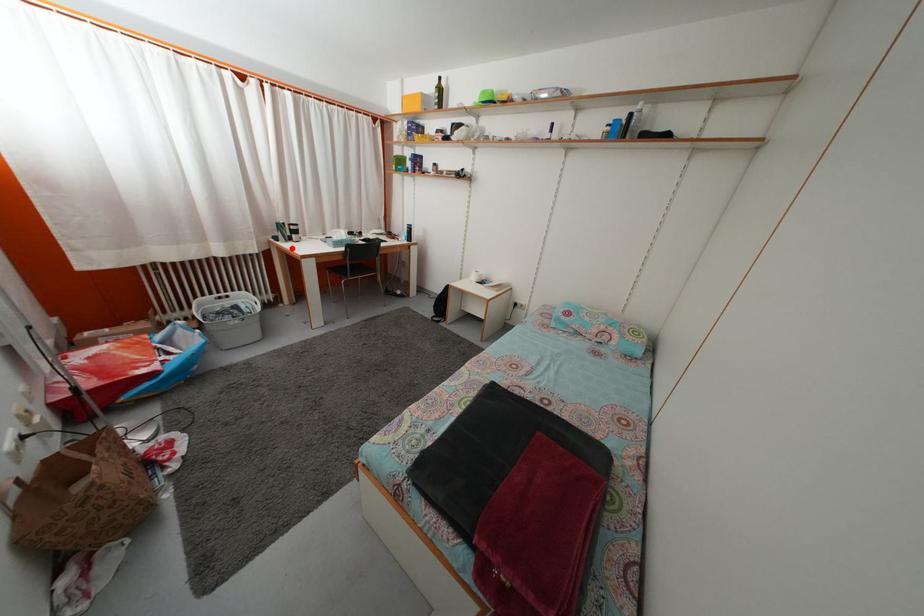
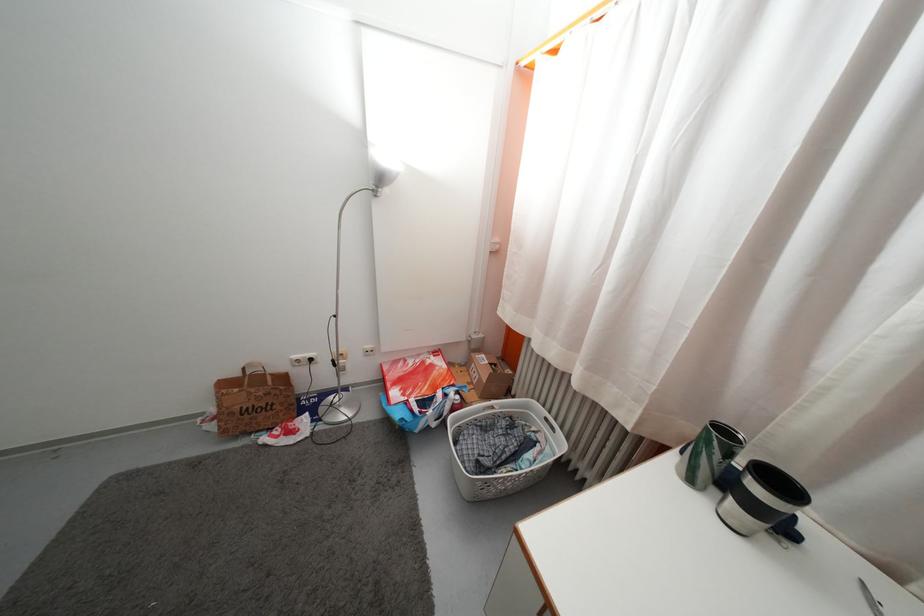
In the second image, find the point that corresponds to the highlighted location in the first image.

(697, 488)